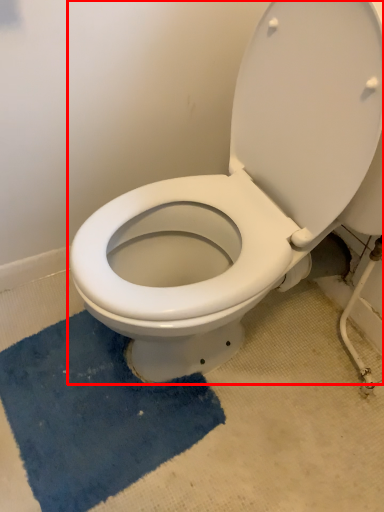
Question: From the image's perspective, where is toilet (annotated by the red box) located relative to bath mat?

Choices:
 (A) above
 (B) below

Answer: (A)